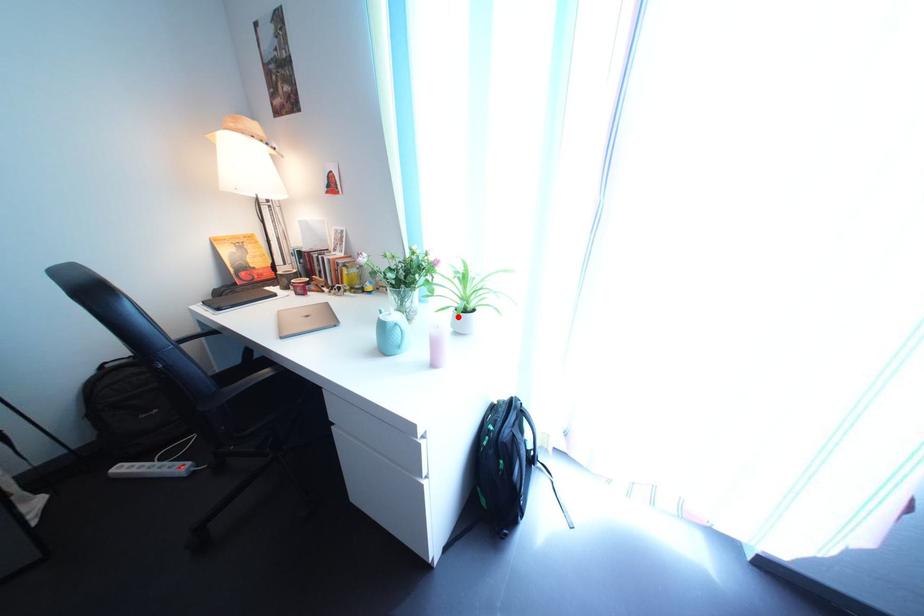
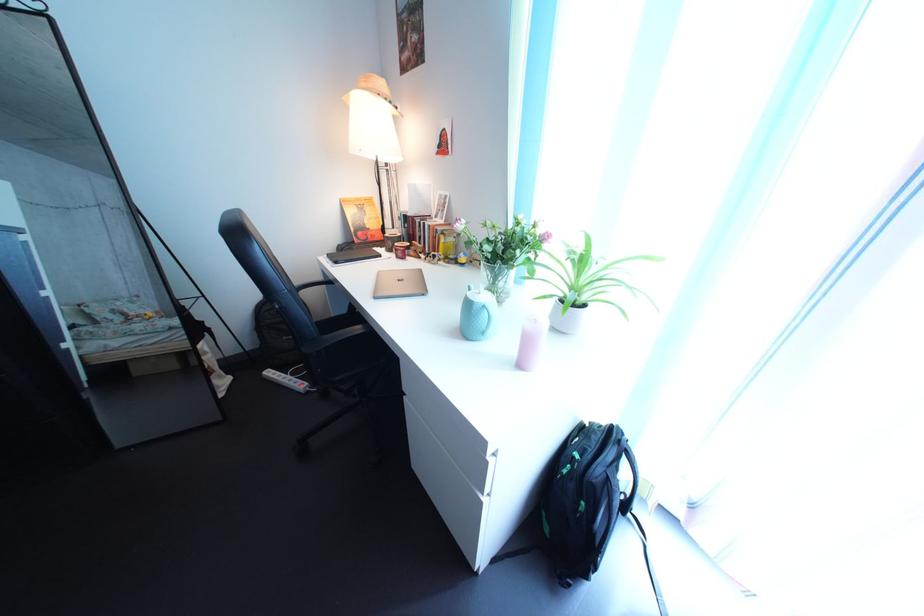
The point at the highlighted location is marked in the first image. Where is the corresponding point in the second image?

(560, 305)